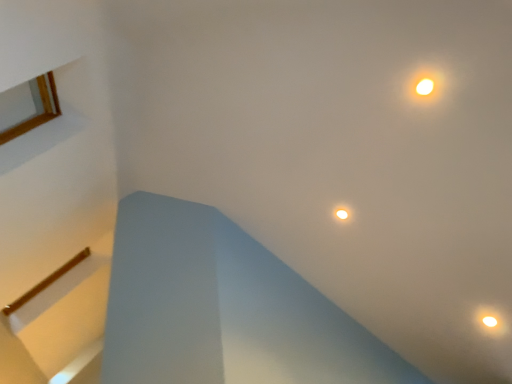
Question: From a real-world perspective, is matte gold droplight at center, which ranks as the 1th droplight in left-to-right order, positioned above or below matte white droplight at lower right, positioned as the second droplight in left-to-right order?

Choices:
 (A) above
 (B) below

Answer: (A)

Question: Based on their sizes in the image, would you say matte gold droplight at center, which is counted as the second droplight, starting from the bottom, is bigger or smaller than matte white droplight at lower right, which ranks as the 1th droplight in right-to-left order?

Choices:
 (A) big
 (B) small

Answer: (A)

Question: Which of these objects is positioned farthest from the matte yellow light at upper right?

Choices:
 (A) matte gold droplight at center, which is counted as the 1th droplight, starting from the back
 (B) matte white droplight at lower right, which ranks as the 1th droplight in right-to-left order

Answer: (B)

Question: Estimate the real-world distances between objects in this image. Which object is closer to the matte yellow light at upper right?

Choices:
 (A) matte gold droplight at center, which is counted as the 1th droplight, starting from the back
 (B) matte white droplight at lower right, the second droplight positioned from the back

Answer: (A)